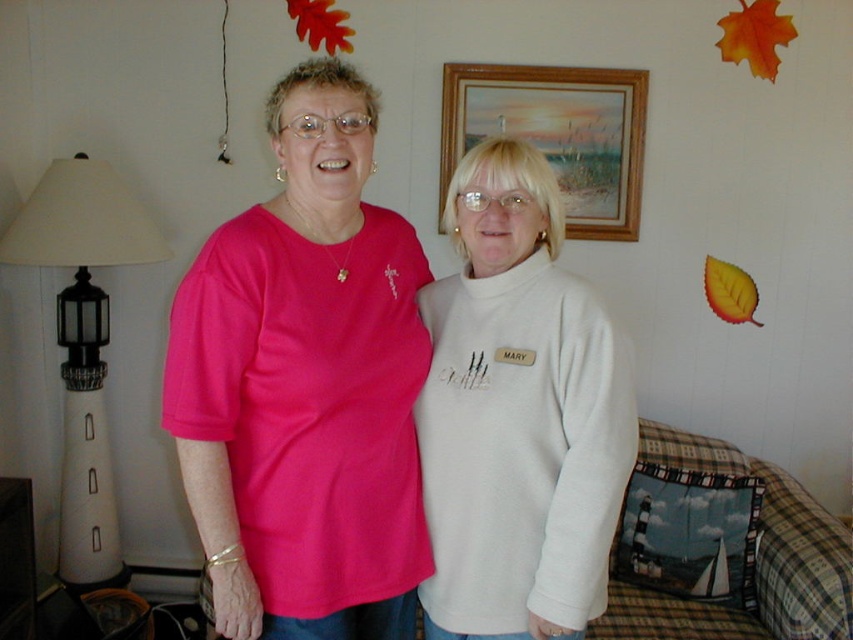
You are a photographer setting up for a group photo. You need to ensure that the white fleece sweater at center and the wooden frame at upper center are both visible in the shot. Based on their positions, which object will appear larger in the photo?

The white fleece sweater at center appears larger in the photo because it is closer to the viewer than the wooden frame at upper center.

You are taking a photo of the matte pink shirt at center and the wooden frame at upper center. Which object will appear larger in the photo?

The matte pink shirt at center will appear larger in the photo because it is closer to the viewer than the wooden frame at upper center.